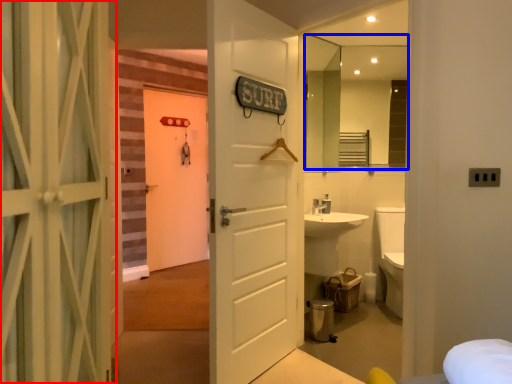
Question: Which object is further to the camera taking this photo, door (highlighted by a red box) or mirror (highlighted by a blue box)?

Choices:
 (A) door
 (B) mirror

Answer: (B)